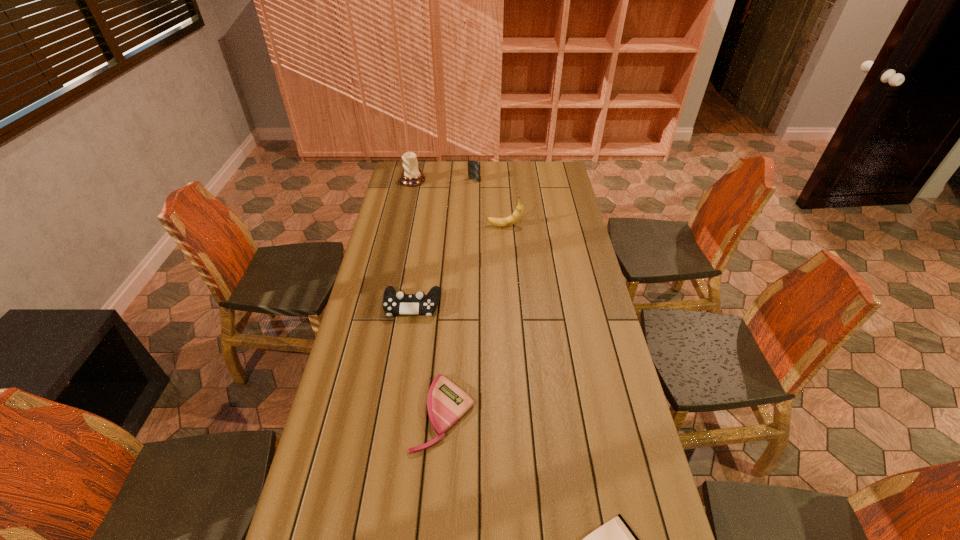
Find the location of a particular element. The width and height of the screenshot is (960, 540). vacant region located 0.370m on the keyboard of the cellular telephone is located at coordinates tap(473, 225).

The image size is (960, 540). Find the location of `vacant space situated on the surface of the fourth farthest object`. vacant space situated on the surface of the fourth farthest object is located at coordinates (407, 335).

Identify the location of free region located on the back of the wristlet. This screenshot has height=540, width=960. (450, 310).

Locate an element on the screen. candle holder at the far edge is located at coordinates (411, 176).

Identify the location of cellular telephone that is at the far edge. (473, 166).

I want to click on candle holder located at the left edge, so click(x=411, y=176).

This screenshot has height=540, width=960. Identify the location of control that is at the left edge. (394, 303).

Find the location of a particular element. Image resolution: width=960 pixels, height=540 pixels. object that is at the far left corner is located at coordinates (411, 176).

I want to click on vacant space at the far edge, so tap(526, 165).

Find the location of `free space at the left edge of the desktop`. free space at the left edge of the desktop is located at coordinates (375, 343).